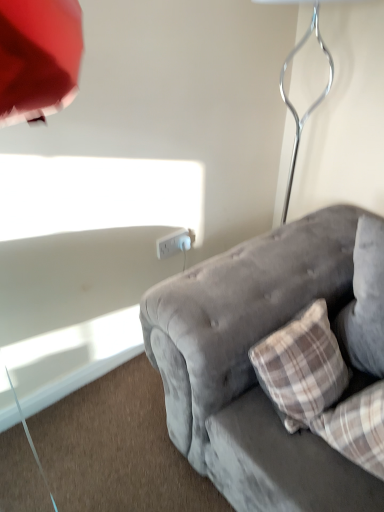
Measure the distance between velvet gray couch at lower right and camera.

The depth of velvet gray couch at lower right is 36.92 inches.

What is the approximate height of velvet gray couch at lower right?

It is 28.93 inches.

Where is `white plastic power outlet at center`? The height and width of the screenshot is (512, 384). white plastic power outlet at center is located at coordinates (175, 243).

Identify the location of power outlet behind the metallic silver table lamp at upper right. This screenshot has height=512, width=384. (175, 243).

Which of these two, metallic silver table lamp at upper right or white plastic power outlet at center, stands taller?

With more height is metallic silver table lamp at upper right.

From a real-world perspective, does metallic silver table lamp at upper right stand above white plastic power outlet at center?

Yes.

From the picture: Is metallic silver table lamp at upper right next to white plastic power outlet at center?

There is a gap between metallic silver table lamp at upper right and white plastic power outlet at center.

Which object is positioned more to the right, white plastic power outlet at center or metallic silver table lamp at upper right?

metallic silver table lamp at upper right.

From a real-world perspective, is white plastic power outlet at center positioned under metallic silver table lamp at upper right based on gravity?

Correct, in the physical world, white plastic power outlet at center is lower than metallic silver table lamp at upper right.

I want to click on table lamp on the right of white plastic power outlet at center, so click(x=346, y=116).

Which is correct: metallic silver table lamp at upper right is inside velvet gray couch at lower right, or outside of it?

metallic silver table lamp at upper right is located beyond the bounds of velvet gray couch at lower right.

Considering the sizes of objects metallic silver table lamp at upper right and velvet gray couch at lower right in the image provided, who is shorter, metallic silver table lamp at upper right or velvet gray couch at lower right?

velvet gray couch at lower right is shorter.

Consider the image. How much distance is there between metallic silver table lamp at upper right and velvet gray couch at lower right?

metallic silver table lamp at upper right is 23.76 inches from velvet gray couch at lower right.

Which object is more forward, metallic silver table lamp at upper right or velvet gray couch at lower right?

velvet gray couch at lower right.

Is velvet gray couch at lower right in front of or behind white plastic power outlet at center in the image?

In the image, velvet gray couch at lower right appears in front of white plastic power outlet at center.

Which is correct: velvet gray couch at lower right is inside white plastic power outlet at center, or outside of it?

velvet gray couch at lower right cannot be found inside white plastic power outlet at center.

Are velvet gray couch at lower right and white plastic power outlet at center far apart?

No.

From the image's perspective, is velvet gray couch at lower right positioned above or below white plastic power outlet at center?

Clearly, from the image's perspective, velvet gray couch at lower right is below white plastic power outlet at center.

Which is behind, velvet gray couch at lower right or metallic silver table lamp at upper right?

metallic silver table lamp at upper right is behind.

Is velvet gray couch at lower right next to metallic silver table lamp at upper right and touching it?

There is a gap between velvet gray couch at lower right and metallic silver table lamp at upper right.

Looking at the image, does velvet gray couch at lower right seem bigger or smaller compared to metallic silver table lamp at upper right?

Clearly, velvet gray couch at lower right is larger in size than metallic silver table lamp at upper right.

How different are the orientations of white plastic power outlet at center and velvet gray couch at lower right in degrees?

89 degrees separate the facing orientations of white plastic power outlet at center and velvet gray couch at lower right.

Is point (192, 239) farther from viewer compared to point (239, 366)?

Yes, point (192, 239) is farther from viewer.

Does white plastic power outlet at center have a greater height compared to velvet gray couch at lower right?

No.

From a real-world perspective, relative to velvet gray couch at lower right, is white plastic power outlet at center vertically above or below?

From a real-world perspective, white plastic power outlet at center is physically above velvet gray couch at lower right.

The width and height of the screenshot is (384, 512). I want to click on power outlet below the metallic silver table lamp at upper right (from a real-world perspective), so click(x=175, y=243).

Locate an element on the screen. power outlet below the metallic silver table lamp at upper right (from the image's perspective) is located at coordinates (175, 243).

Estimate the real-world distances between objects in this image. Which object is closer to metallic silver table lamp at upper right, velvet gray couch at lower right or white plastic power outlet at center?

Among the two, velvet gray couch at lower right is located nearer to metallic silver table lamp at upper right.

When comparing their distances from velvet gray couch at lower right, does metallic silver table lamp at upper right or white plastic power outlet at center seem closer?

white plastic power outlet at center is closer to velvet gray couch at lower right.

Looking at the image, which one is located further to white plastic power outlet at center, velvet gray couch at lower right or metallic silver table lamp at upper right?

metallic silver table lamp at upper right lies further to white plastic power outlet at center than the other object.

Estimate the real-world distances between objects in this image. Which object is closer to velvet gray couch at lower right, white plastic power outlet at center or metallic silver table lamp at upper right?

white plastic power outlet at center lies closer to velvet gray couch at lower right than the other object.

When comparing their distances from white plastic power outlet at center, does metallic silver table lamp at upper right or velvet gray couch at lower right seem closer?

Among the two, velvet gray couch at lower right is located nearer to white plastic power outlet at center.

When comparing their distances from metallic silver table lamp at upper right, does white plastic power outlet at center or velvet gray couch at lower right seem further?

white plastic power outlet at center is positioned further to the anchor metallic silver table lamp at upper right.

You are a GUI agent. You are given a task and a screenshot of the screen. Output one action in this format:
    pyautogui.click(x=<x>, y=<y>)
    Task: Click on the table lamp positioned between velvet gray couch at lower right and white plastic power outlet at center from near to far
    
    Given the screenshot: What is the action you would take?
    coord(346,116)